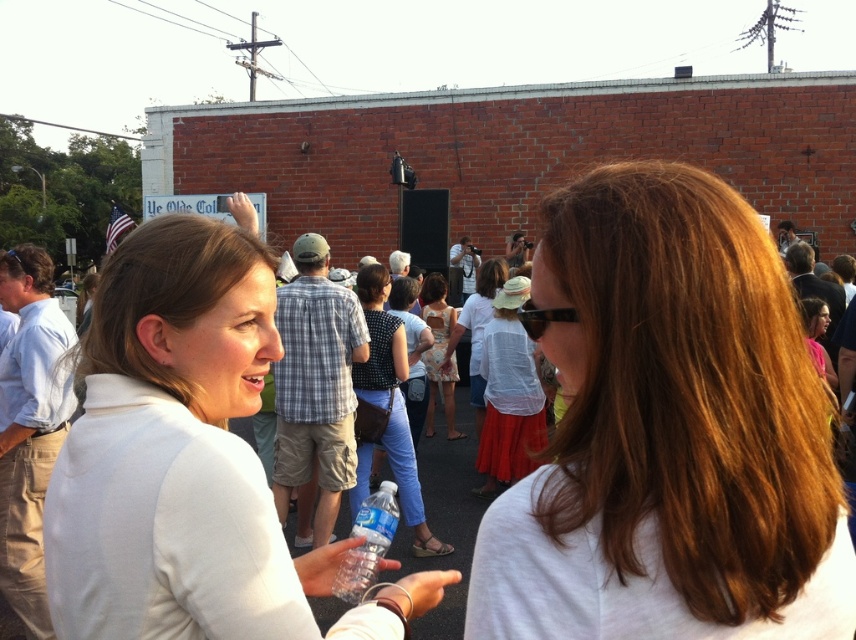
Question: Does white matte shirt at center appear on the left side of clear plastic water bottle at center?

Choices:
 (A) yes
 (B) no

Answer: (A)

Question: Among these objects, which one is farthest from the camera?

Choices:
 (A) white matte shirt at center
 (B) shiny brown hair at center

Answer: (A)

Question: Is black textured blouse at center below clear plastic water bottle at center?

Choices:
 (A) yes
 (B) no

Answer: (A)

Question: Which of the following is the closest to the observer?

Choices:
 (A) (62, 561)
 (B) (623, 362)
 (C) (366, 499)
 (D) (372, 358)

Answer: (B)

Question: Can you confirm if white matte shirt at center is bigger than black textured blouse at center?

Choices:
 (A) yes
 (B) no

Answer: (B)

Question: Based on their relative distances, which object is nearer to the black textured blouse at center?

Choices:
 (A) clear plastic water bottle at center
 (B) shiny brown hair at center
 (C) white matte shirt at center

Answer: (A)